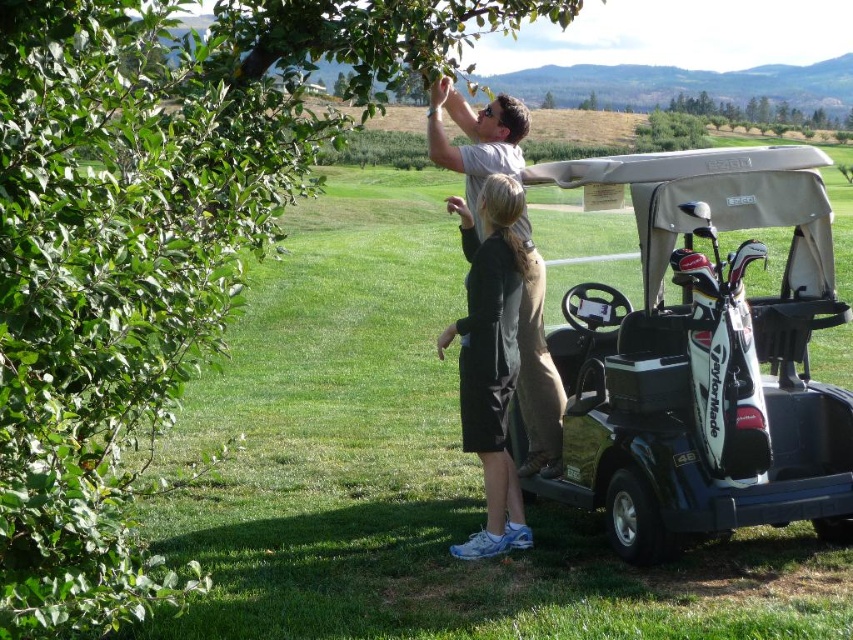
Question: Is black matte golf cart at center closer to the viewer compared to light gray cotton shirt at upper center?

Choices:
 (A) no
 (B) yes

Answer: (B)

Question: Which object is the farthest from the black matte golf cart at center?

Choices:
 (A) green grass at center
 (B) green leafy tree at upper left
 (C) light gray cotton shirt at upper center

Answer: (B)

Question: Among these points, which one is farthest from the camera?

Choices:
 (A) (434, 285)
 (B) (509, 544)

Answer: (A)

Question: Which point appears closest to the camera in this image?

Choices:
 (A) (535, 396)
 (B) (76, 266)
 (C) (439, 253)

Answer: (B)

Question: Does black matte golf cart at center appear on the left side of black matte dress at center?

Choices:
 (A) no
 (B) yes

Answer: (A)

Question: Does green grass at center have a lesser width compared to black matte dress at center?

Choices:
 (A) yes
 (B) no

Answer: (B)